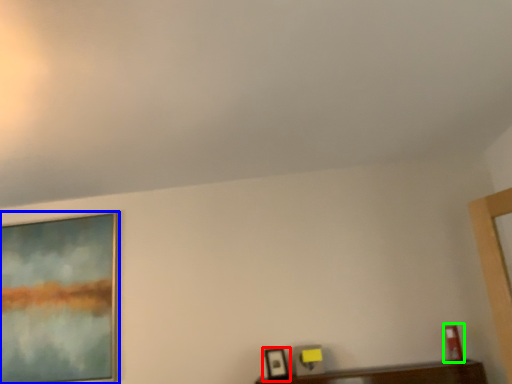
Question: Estimate the real-world distances between objects in this image. Which object is closer to picture frame (highlighted by a red box), picture frame (highlighted by a blue box) or picture frame (highlighted by a green box)?

Choices:
 (A) picture frame
 (B) picture frame

Answer: (B)